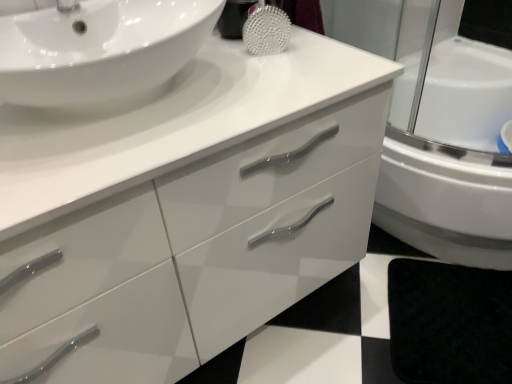
This screenshot has width=512, height=384. I want to click on vacant space underneath black matte bath mat at lower right (from a real-world perspective), so click(451, 343).